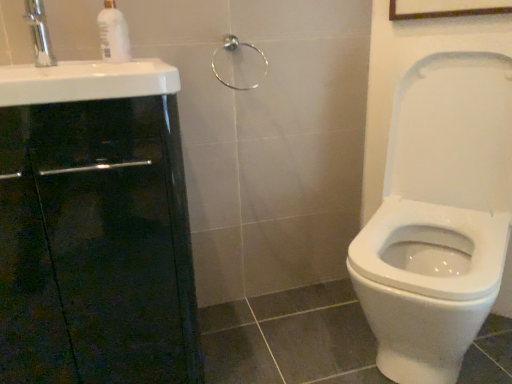
Question: Is white glossy soap dispenser at upper left smaller than satin nickel towel ring at upper center?

Choices:
 (A) yes
 (B) no

Answer: (B)

Question: From a real-world perspective, is white glossy soap dispenser at upper left below satin nickel towel ring at upper center?

Choices:
 (A) no
 (B) yes

Answer: (A)

Question: Is white glossy soap dispenser at upper left to the right of satin nickel towel ring at upper center from the viewer's perspective?

Choices:
 (A) no
 (B) yes

Answer: (A)

Question: Are white glossy soap dispenser at upper left and satin nickel towel ring at upper center far apart?

Choices:
 (A) no
 (B) yes

Answer: (A)

Question: From the image's perspective, is white glossy soap dispenser at upper left located beneath satin nickel towel ring at upper center?

Choices:
 (A) yes
 (B) no

Answer: (B)

Question: Does white glossy soap dispenser at upper left have a larger size compared to satin nickel towel ring at upper center?

Choices:
 (A) no
 (B) yes

Answer: (B)

Question: From the image's perspective, does silver metallic faucet at upper left appear higher than black glossy cabinet at left?

Choices:
 (A) yes
 (B) no

Answer: (A)

Question: Considering the relative positions of silver metallic faucet at upper left and black glossy cabinet at left in the image provided, is silver metallic faucet at upper left in front of black glossy cabinet at left?

Choices:
 (A) no
 (B) yes

Answer: (A)

Question: From a real-world perspective, is silver metallic faucet at upper left located higher than black glossy cabinet at left?

Choices:
 (A) yes
 (B) no

Answer: (A)

Question: Is silver metallic faucet at upper left aimed at black glossy cabinet at left?

Choices:
 (A) yes
 (B) no

Answer: (B)

Question: Is silver metallic faucet at upper left touching black glossy cabinet at left?

Choices:
 (A) no
 (B) yes

Answer: (A)

Question: Does silver metallic faucet at upper left lie behind black glossy cabinet at left?

Choices:
 (A) yes
 (B) no

Answer: (A)

Question: Is black glossy cabinet at left completely or partially inside satin nickel towel ring at upper center?

Choices:
 (A) no
 (B) yes

Answer: (A)